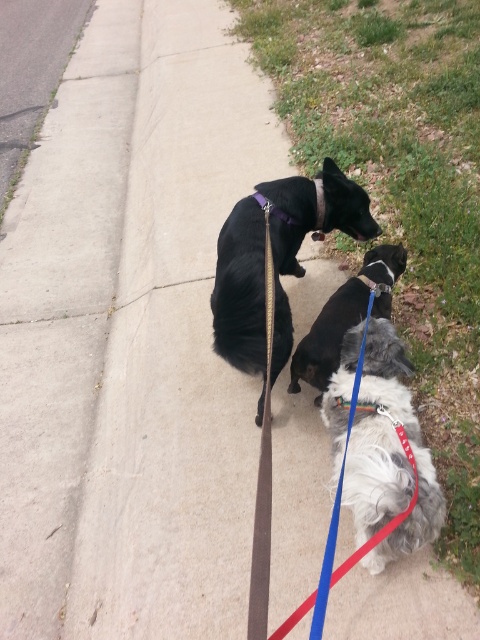
Question: Which object appears closest to the camera in this image?

Choices:
 (A) fluffy white dog at center
 (B) black fur dog at center
 (C) blue nylon leash at center

Answer: (C)

Question: Does white fabric neckband at center appear under matte purple neckband at center?

Choices:
 (A) yes
 (B) no

Answer: (A)

Question: Which point appears closest to the camera in this image?

Choices:
 (A) (264, 579)
 (B) (373, 292)
 (C) (298, 268)
 (D) (405, 356)

Answer: (A)

Question: Where is fluffy white dog at center located in relation to matte purple neckband at center in the image?

Choices:
 (A) below
 (B) above

Answer: (A)

Question: Is fluffy white dog at center to the left of black matte dog at center from the viewer's perspective?

Choices:
 (A) no
 (B) yes

Answer: (A)

Question: Among these points, which one is nearest to the camera?

Choices:
 (A) (336, 400)
 (B) (389, 289)
 (C) (339, 289)

Answer: (A)